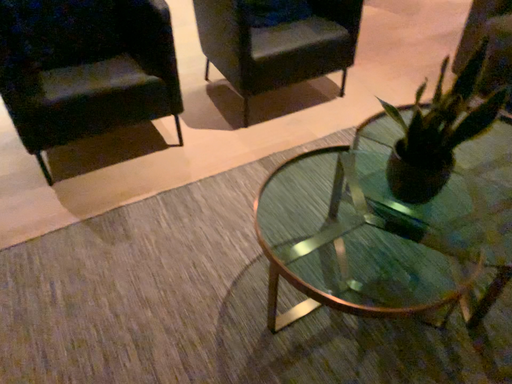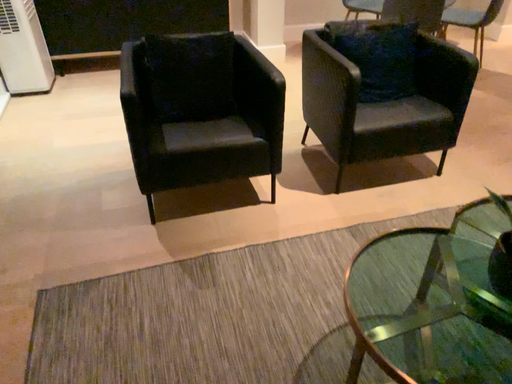
Question: How did the camera likely rotate when shooting the video?

Choices:
 (A) rotated right
 (B) rotated left

Answer: (B)